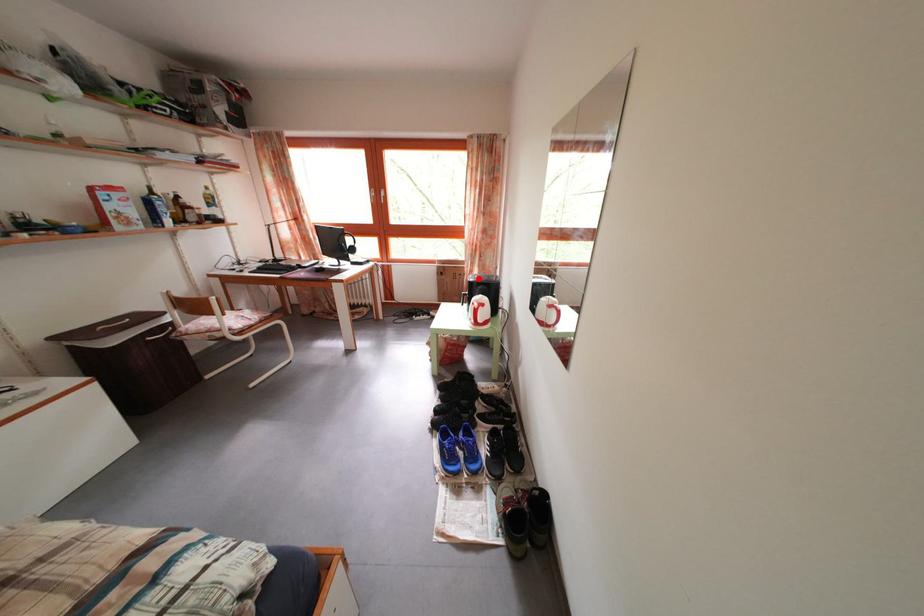
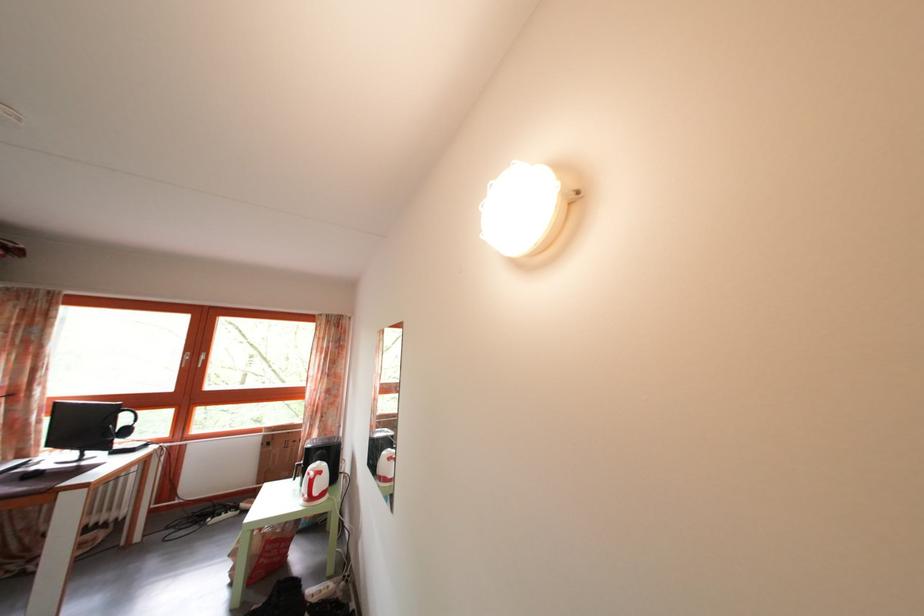
Question: I am providing you with two images of the same scene from different viewpoints. A red point is marked on the first image. Can you still see the location of the red point in image 2?

Choices:
 (A) Yes
 (B) No

Answer: (A)